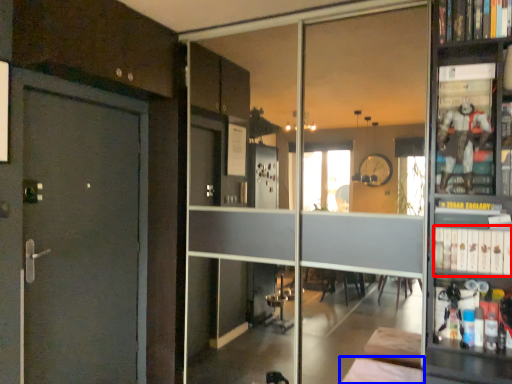
Question: Which of the following is the closest to the observer, book (highlighted by a red box) or furniture (highlighted by a blue box)?

Choices:
 (A) book
 (B) furniture

Answer: (B)